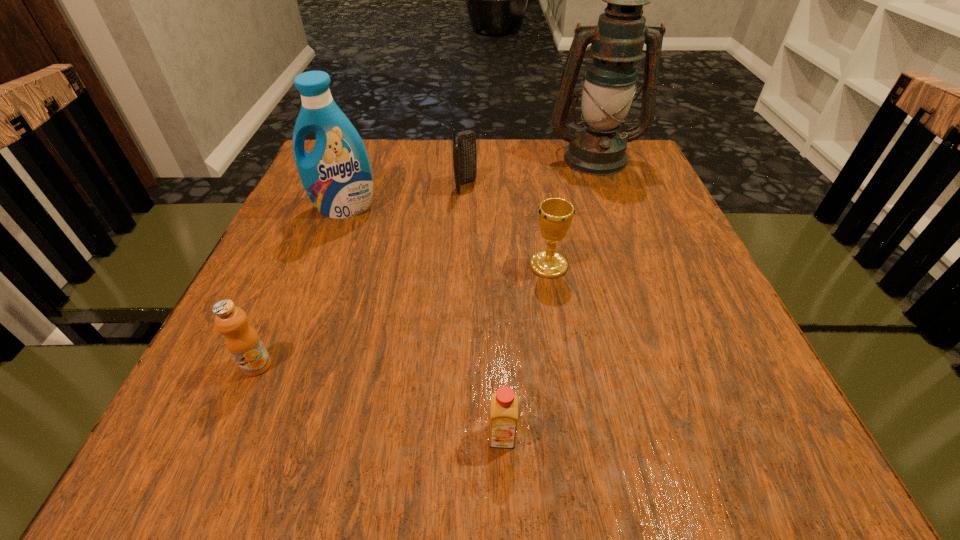
At what (x,y) coordinates should I click in order to perform the action: click on blank area in the image that satisfies the following two spatial constraints: 1. on the front side of the tallest object; 2. on the keyboard of the fourth object from right to left. Please return your answer as a coordinate pair (x, y). This screenshot has height=540, width=960. Looking at the image, I should click on (605, 187).